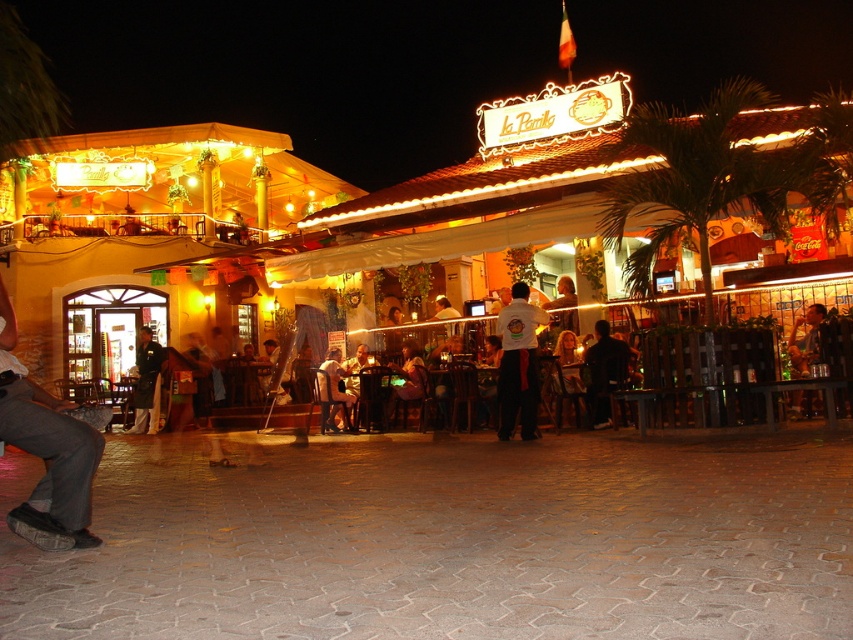
Who is more distant from viewer, (508, 435) or (815, 339)?

The point (815, 339) is more distant.

Does point (511, 388) lie behind point (796, 349)?

No, (511, 388) is closer to viewer.

Does point (534, 372) lie in front of point (811, 305)?

Yes, point (534, 372) is in front of point (811, 305).

Where is `white t-shirt at center`? white t-shirt at center is located at coordinates (518, 364).

Between denim pants at lower left and dark green uniform at center, which one appears on the right side from the viewer's perspective?

denim pants at lower left is more to the right.

Who is shorter, denim pants at lower left or dark green uniform at center?

denim pants at lower left

The image size is (853, 640). I want to click on denim pants at lower left, so click(45, 451).

Who is more distant from viewer, (x=74, y=460) or (x=529, y=378)?

Point (x=529, y=378)

Is point (82, 499) behind point (502, 317)?

That is False.

Describe the element at coordinates (45, 451) in the screenshot. This screenshot has height=640, width=853. I see `denim pants at lower left` at that location.

Where is `denim pants at lower left`? This screenshot has width=853, height=640. denim pants at lower left is located at coordinates (45, 451).